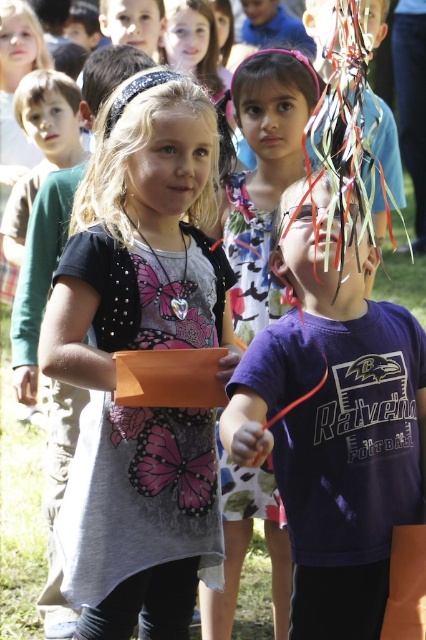
Looking at this image, you are a photographer setting up a tripod to capture the scene described. You need to position it so that the matte gray dress at center is in the exact center of your shot. Given that the coordinate system of your camera is normalized from 0 to 1 in both x and y axes, where would you set the tripod coordinates to ensure the dress is centered?

The matte gray dress at center is located at point (141, 349), so you should set the tripod coordinates to 0.547 in the x and 0.331 in the y to center it.

You are a photographer trying to capture a photo of both points in the image. The first point is at position point (146, 440) and the second point is at position point (344, 540). You want to ensure both are in focus. Since you can only focus on one point at a time, which point should you focus on to maximize the chance that both are somewhat in focus?

You should focus on point (146, 440) because it is closer to the viewer than point (344, 540). Focusing on the closer object increases the depth of field, making the farther point more likely to be in focus as well.